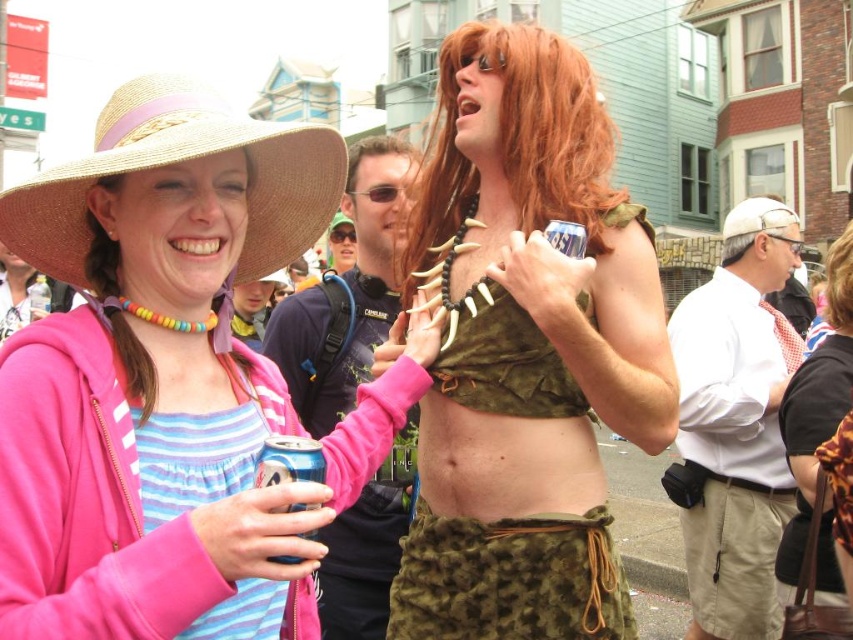
Is fuzzy green skirt at center taller than black plastic goggles at center?

Yes, fuzzy green skirt at center is taller than black plastic goggles at center.

Where is `fuzzy green skirt at center`? fuzzy green skirt at center is located at coordinates (509, 579).

Can you confirm if camouflage fabric top at center is positioned to the right of black plastic goggles at center?

Indeed, camouflage fabric top at center is positioned on the right side of black plastic goggles at center.

Is point (535, 464) positioned after point (346, 236)?

That is False.

You are a GUI agent. You are given a task and a screenshot of the screen. Output one action in this format:
    pyautogui.click(x=<x>, y=<y>)
    Task: Click on the camouflage fabric top at center
    
    Given the screenshot: What is the action you would take?
    pyautogui.click(x=526, y=349)

Based on the photo, does straw hat at upper left appear under fuzzy green skirt at center?

Incorrect, straw hat at upper left is not positioned below fuzzy green skirt at center.

Who is more forward, (267,241) or (480,552)?

Point (480,552) is more forward.

At what (x,y) coordinates should I click in order to perform the action: click on straw hat at upper left. Please return your answer as a coordinate pair (x, y). This screenshot has height=640, width=853. Looking at the image, I should click on (180, 161).